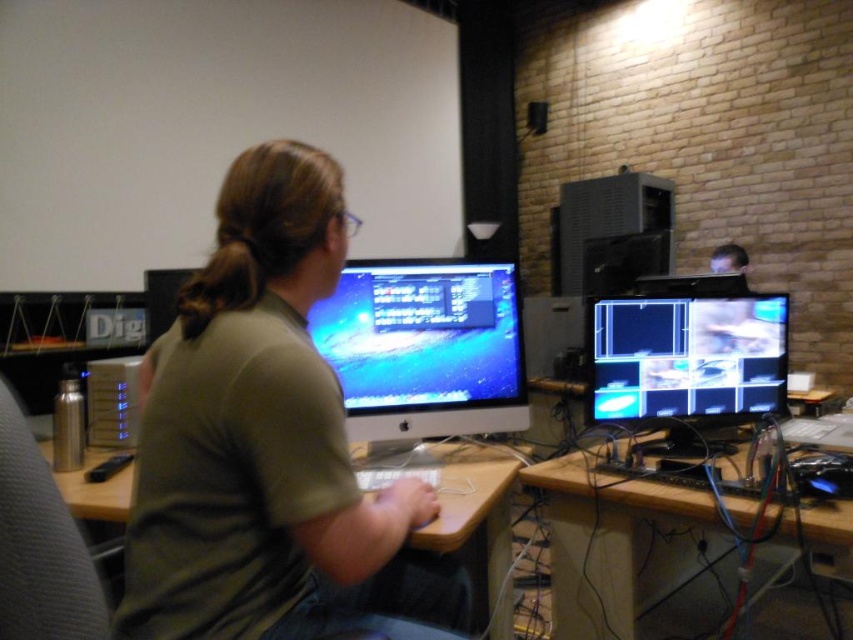
Question: Estimate the real-world distances between objects in this image. Which object is closer to the black glossy monitor at right?

Choices:
 (A) satin black monitor at center
 (B) green matte shirt at center

Answer: (A)

Question: Estimate the real-world distances between objects in this image. Which object is closer to the satin black monitor at center?

Choices:
 (A) black glossy monitor at right
 (B) green matte shirt at center

Answer: (A)

Question: Is satin black monitor at center to the left of wooden desk at center from the viewer's perspective?

Choices:
 (A) no
 (B) yes

Answer: (B)

Question: Among these objects, which one is farthest from the camera?

Choices:
 (A) wooden at center
 (B) brown hair at upper center
 (C) satin black monitor at center

Answer: (C)

Question: Can you confirm if green matte shirt at center is positioned below satin black monitor at center?

Choices:
 (A) no
 (B) yes

Answer: (B)

Question: Is green matte shirt at center closer to camera compared to brown hair at upper center?

Choices:
 (A) no
 (B) yes

Answer: (B)